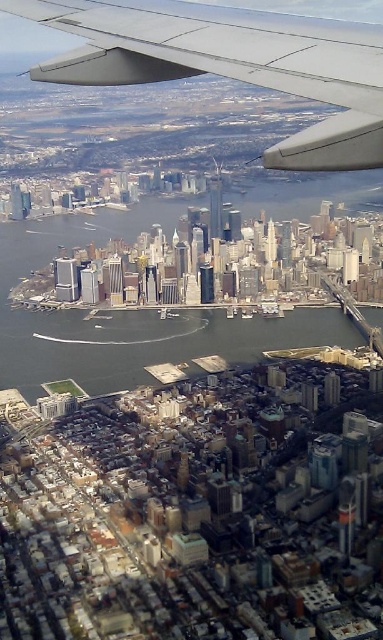
Question: Is green water at center smaller than matte gray wing at upper center?

Choices:
 (A) no
 (B) yes

Answer: (A)

Question: Can you confirm if green water at center is bigger than matte gray wing at upper center?

Choices:
 (A) no
 (B) yes

Answer: (B)

Question: Does green water at center appear over matte gray wing at upper center?

Choices:
 (A) no
 (B) yes

Answer: (A)